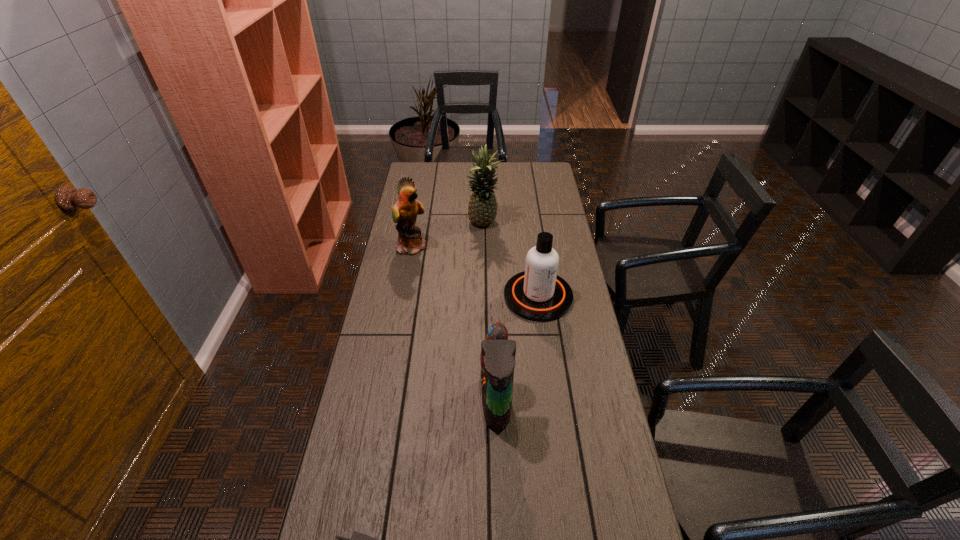
Where is `pineapple`? The height and width of the screenshot is (540, 960). pineapple is located at coordinates (482, 209).

Image resolution: width=960 pixels, height=540 pixels. In order to click on the farther parrot in this screenshot , I will do `click(404, 212)`.

Where is `the taller parrot`? The height and width of the screenshot is (540, 960). the taller parrot is located at coordinates (404, 212).

I want to click on cleansing agent, so click(538, 294).

Locate an element on the screen. the shorter parrot is located at coordinates (497, 358).

Locate an element on the screen. The height and width of the screenshot is (540, 960). the nearer parrot is located at coordinates (497, 358).

The image size is (960, 540). In order to click on vacant space located 0.310m on the front of the pineapple in this screenshot , I will do `click(484, 286)`.

Identify the location of free spot located 0.110m on the front-facing side of the taller parrot. The width and height of the screenshot is (960, 540). (454, 246).

Image resolution: width=960 pixels, height=540 pixels. Find the location of `free space located 0.290m on the back of the cleansing agent`. free space located 0.290m on the back of the cleansing agent is located at coordinates (529, 229).

Identify the location of free point located at the face of the second nearest object. (400, 402).